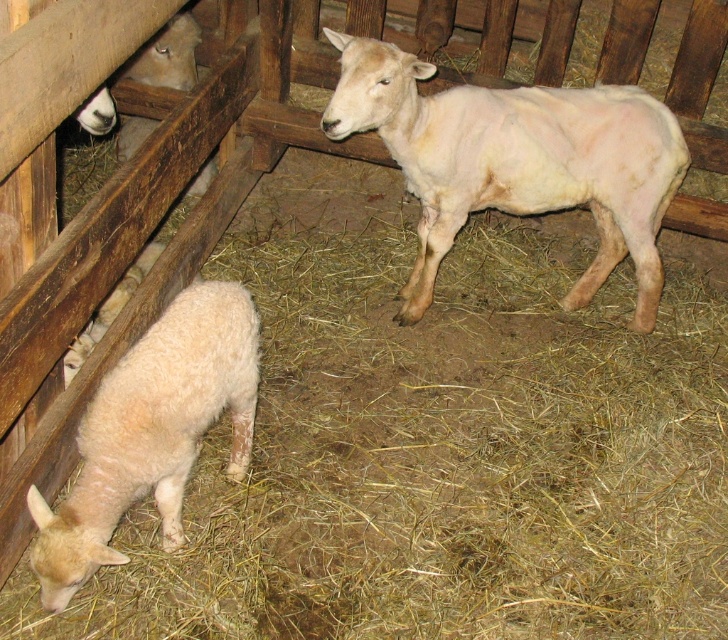
Question: Among these points, which one is farthest from the camera?

Choices:
 (A) (122, 392)
 (B) (649, 204)

Answer: (B)

Question: Is white woolen sheep at center to the right of white woolen lamb at lower left from the viewer's perspective?

Choices:
 (A) yes
 (B) no

Answer: (A)

Question: Can you confirm if white woolen sheep at center is smaller than white woolen lamb at lower left?

Choices:
 (A) no
 (B) yes

Answer: (A)

Question: Which object is farther from the camera taking this photo?

Choices:
 (A) white woolen lamb at lower left
 (B) white woolen sheep at center

Answer: (B)

Question: Does white woolen sheep at center have a smaller size compared to white woolen lamb at lower left?

Choices:
 (A) no
 (B) yes

Answer: (A)